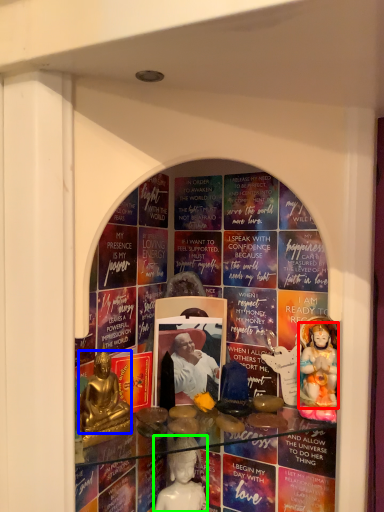
Question: Which object is the farthest from person (highlighted by a red box)? Choose among these: person (highlighted by a blue box) or person (highlighted by a green box).

Choices:
 (A) person
 (B) person

Answer: (A)